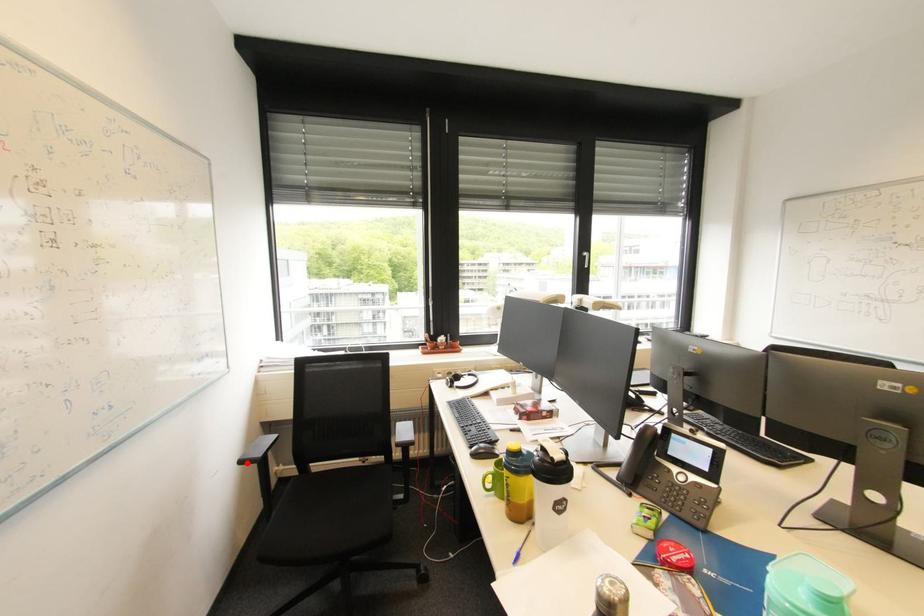
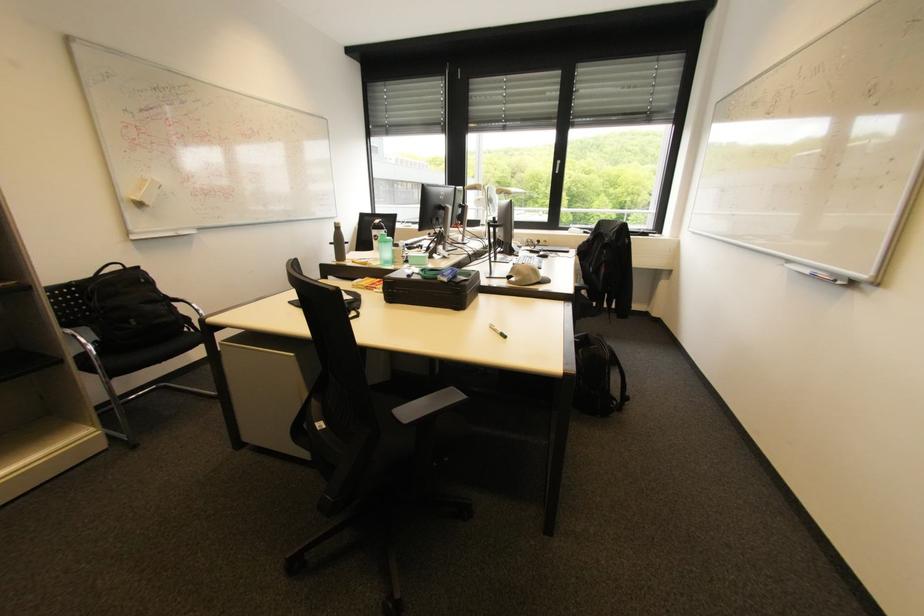
Find the pixel in the second image that matches the highlighted location in the first image.

(335, 244)